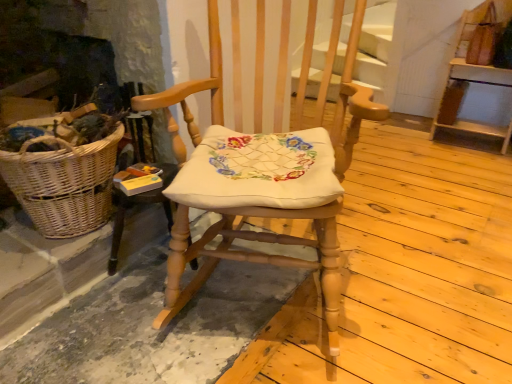
The height and width of the screenshot is (384, 512). What are the coordinates of `vacant space underneath wooden rocking chair at center (from a real-world perspective)` in the screenshot? It's located at (258, 289).